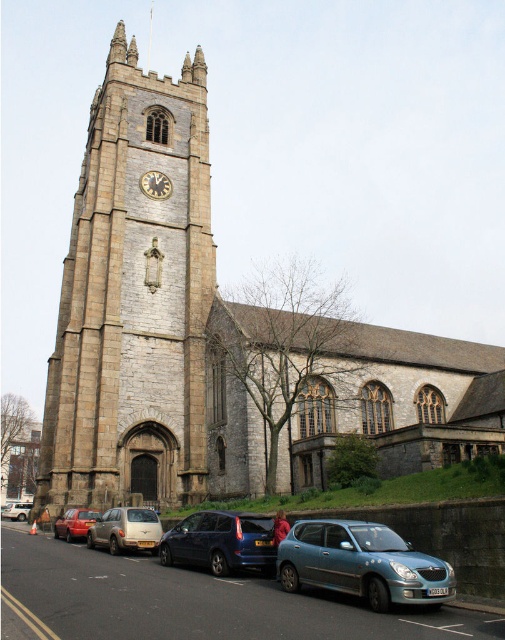
You are a pedestrian standing on the sidewalk in front of the historic stone church. You see a silver metallic hatchback at center and a metallic red car at lower left. Which car is positioned higher in the image?

Answer: The silver metallic hatchback at center is above metallic red car at lower left in the image.

Consider the image. You are a pedestrian standing at the entrance of the historic stone church. You notice two vehicles in the parking lot. Which vehicle is closer to you, the silver metallic hatchback at center or the silver metallic van at lower left?

The silver metallic hatchback at center is closer to you because it is in front of the silver metallic van at lower left.

You are a photographer planning to take a picture of the historic stone church. You have two vans, a metallic blue van at center and a silver metallic van at lower left. Which van should you move to ensure it doesn t block the view of the church tower?

The metallic blue van at center has a smaller size compared to silver metallic van at lower left. Therefore, moving the silver metallic van at lower left would be more effective in unblocking the view of the church tower since it is larger and more likely obstructing the view.